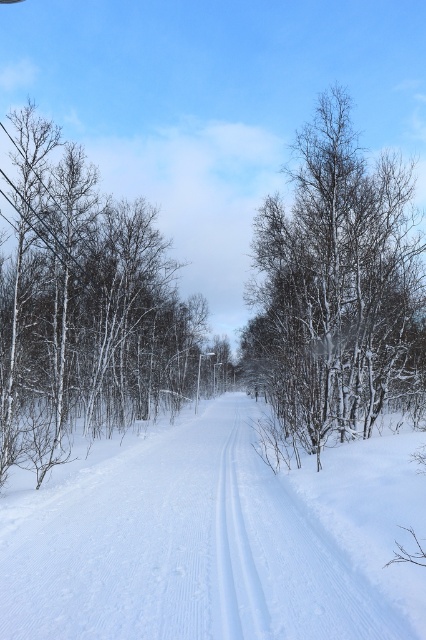
Can you confirm if white powdery snow at center is smaller than snow-covered trees at left?

Yes.

Between point (115, 502) and point (2, 445), which one is positioned behind?

Positioned behind is point (2, 445).

Locate an element on the screen. The width and height of the screenshot is (426, 640). white powdery snow at center is located at coordinates (213, 538).

Does point (36, 406) lie in front of point (391, 230)?

Yes, it is.

Measure the distance between snow-covered trees at left and snow-covered tree at center.

18.13 meters

At what (x,y) coordinates should I click in order to perform the action: click on snow-covered trees at left. Please return your answer as a coordinate pair (x, y). Looking at the image, I should click on (83, 308).

From the picture: Who is more forward, (x=17, y=605) or (x=232, y=512)?

Point (x=17, y=605) is more forward.

I want to click on white powdery snow at center, so click(x=213, y=538).

I want to click on white powdery snow at center, so click(213, 538).

The image size is (426, 640). Find the location of `white powdery snow at center`. white powdery snow at center is located at coordinates (213, 538).